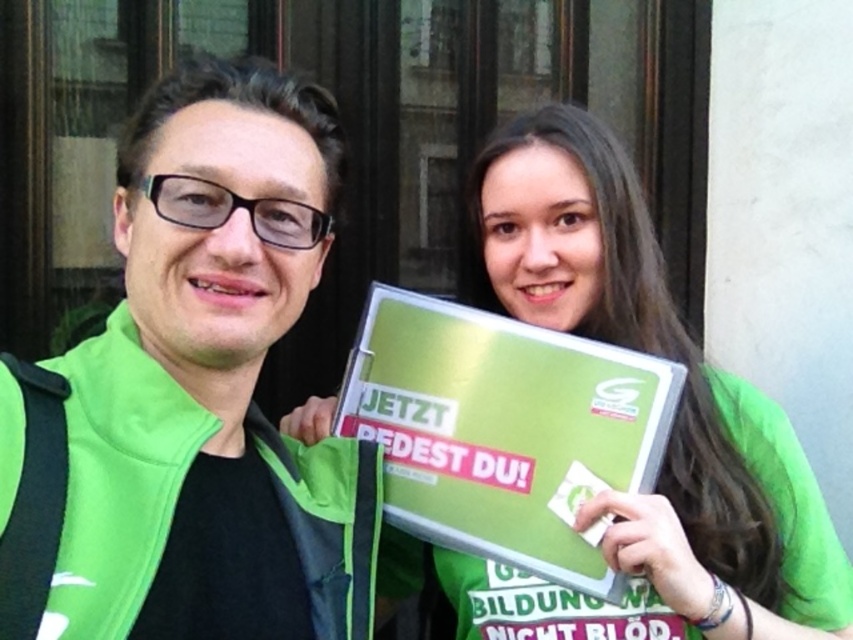
Question: Is green fabric jacket at left above green matte sign at center?

Choices:
 (A) no
 (B) yes

Answer: (B)

Question: Which point appears farthest from the camera in this image?

Choices:
 (A) (485, 193)
 (B) (260, 353)

Answer: (A)

Question: Observing the image, what is the correct spatial positioning of green fabric jacket at left in reference to green matte sign at center?

Choices:
 (A) right
 (B) left

Answer: (B)

Question: Considering the relative positions of green fabric jacket at left and green matte sign at center in the image provided, where is green fabric jacket at left located with respect to green matte sign at center?

Choices:
 (A) above
 (B) below

Answer: (A)

Question: Among these objects, which one is nearest to the camera?

Choices:
 (A) green fabric jacket at left
 (B) green matte sign at center

Answer: (A)

Question: Which point is closer to the camera?

Choices:
 (A) green matte sign at center
 (B) green fabric jacket at left

Answer: (B)